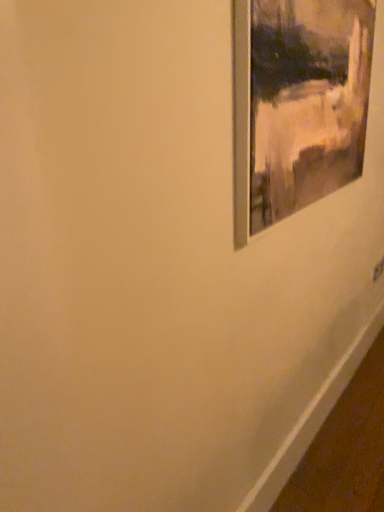
What is the approximate height of metallic silver picture frame at upper right?

Answer: It is 27.36 inches.

What do you see at coordinates (297, 103) in the screenshot? I see `metallic silver picture frame at upper right` at bounding box center [297, 103].

The width and height of the screenshot is (384, 512). I want to click on metallic silver picture frame at upper right, so click(297, 103).

The image size is (384, 512). Identify the location of metallic silver picture frame at upper right. (297, 103).